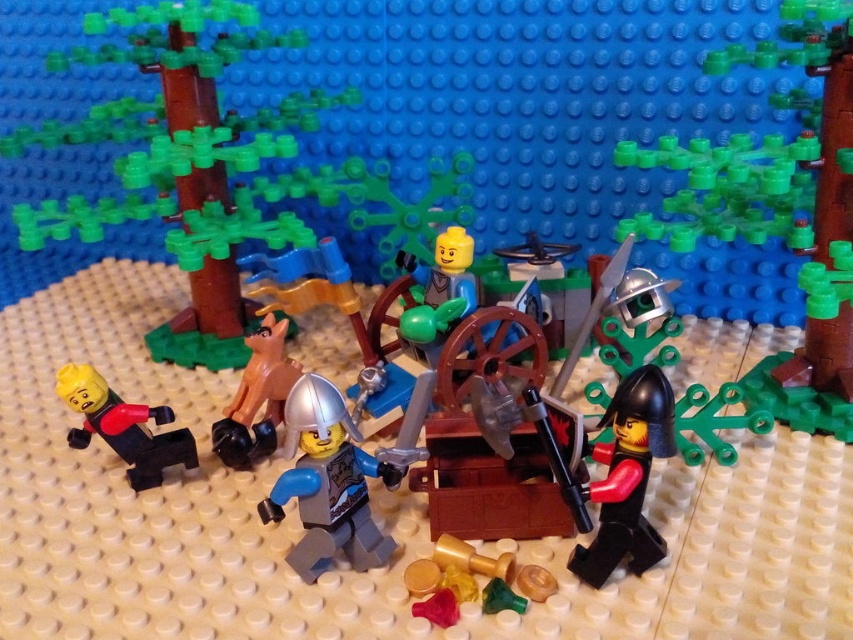
Question: Among these objects, which one is farthest from the camera?

Choices:
 (A) matte black minifigure at left
 (B) matte black helmet at lower right
 (C) light blue plastic minifigure at center
 (D) brown wood tree at left

Answer: (D)

Question: Does matte black minifigure at left have a smaller size compared to brown matte animal at center?

Choices:
 (A) yes
 (B) no

Answer: (B)

Question: From the image, what is the correct spatial relationship of brown wood tree at left in relation to light blue plastic minifigure at center?

Choices:
 (A) left
 (B) right

Answer: (A)

Question: Estimate the real-world distances between objects in this image. Which object is farther from the brown matte animal at center?

Choices:
 (A) shiny silver sword at center right
 (B) brown wood tree at left
 (C) light blue plastic minifigure at center

Answer: (A)

Question: Which object is farther from the camera taking this photo?

Choices:
 (A) shiny silver sword at center right
 (B) matte black helmet at lower right
 (C) matte black minifigure at left
 (D) brown matte animal at center

Answer: (A)

Question: Is matte black minifigure at left smaller than brown matte animal at center?

Choices:
 (A) yes
 (B) no

Answer: (B)